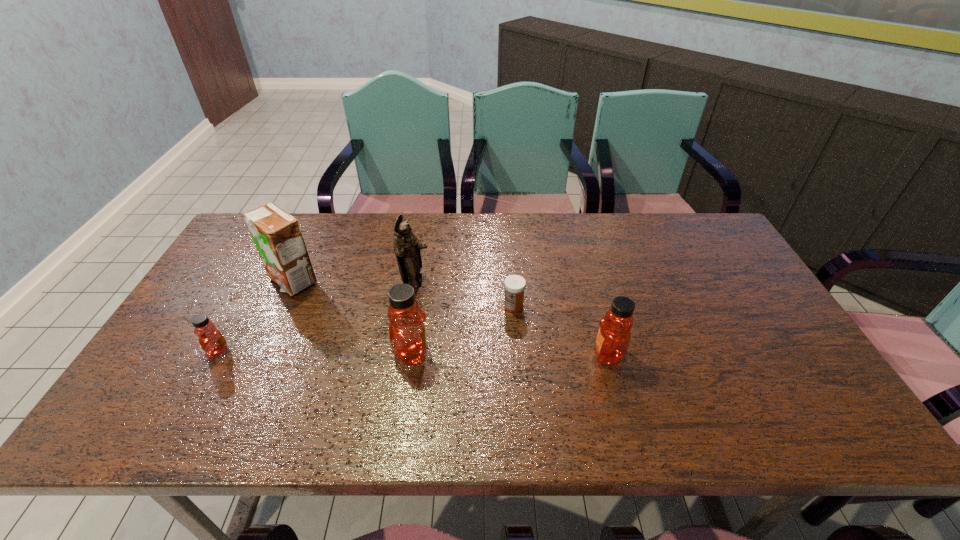
You are a GUI agent. You are given a task and a screenshot of the screen. Output one action in this format:
    pyautogui.click(x=<x>, y=<y>)
    Task: Click on the vacant space located 0.100m on the front label of the leftmost honey
    The image size is (960, 540).
    Given the screenshot: What is the action you would take?
    pyautogui.click(x=167, y=352)

The height and width of the screenshot is (540, 960). In order to click on vacant space situated on the front label of the second honey from right to left in this screenshot , I will do `click(467, 353)`.

Where is `vacant space situated on the front label of the rightmost object`? Image resolution: width=960 pixels, height=540 pixels. vacant space situated on the front label of the rightmost object is located at coordinates (503, 354).

I want to click on vacant space located 0.280m on the front label of the rightmost object, so click(479, 354).

Locate an element on the screen. This screenshot has height=540, width=960. vacant point located 0.340m on the front label of the rightmost object is located at coordinates (455, 354).

Locate an element on the screen. This screenshot has height=540, width=960. vacant space located on the front-facing side of the figurine is located at coordinates (564, 282).

Find the location of a particular element. This screenshot has width=960, height=540. free location located on the straw side of the carton is located at coordinates (240, 393).

At what (x,y) coordinates should I click in order to perform the action: click on vacant space located 0.320m on the right of the fifth object from left to right. Please return your answer as a coordinate pair (x, y). The height and width of the screenshot is (540, 960). Looking at the image, I should click on (639, 306).

Find the location of `object present at the left edge`. object present at the left edge is located at coordinates (213, 343).

This screenshot has height=540, width=960. Identify the location of vacant space at the far edge. (326, 233).